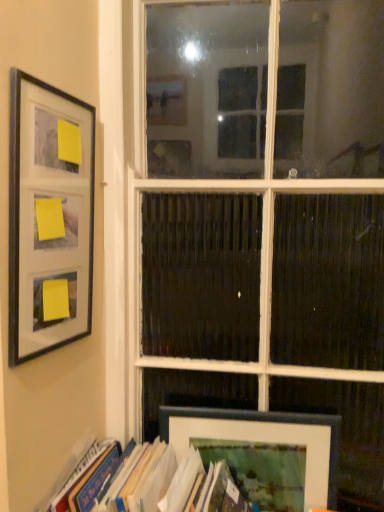
Question: In terms of size, does white glass window at center appear bigger or smaller than hardcover book at lower left?

Choices:
 (A) big
 (B) small

Answer: (A)

Question: From a real-world perspective, relative to hardcover book at lower left, is white glass window at center vertically above or below?

Choices:
 (A) below
 (B) above

Answer: (B)

Question: Which is nearer to the matte black frame at lower right, which is counted as the second picture frame, starting from the top?

Choices:
 (A) hardcover book at lower left
 (B) matte black frame at left, placed as the first picture frame when sorted from front to back
 (C) white glass window at center

Answer: (A)

Question: Which object is positioned farthest from the matte black frame at lower right, marked as the second picture frame in a left-to-right arrangement?

Choices:
 (A) matte black frame at left, placed as the first picture frame when sorted from front to back
 (B) white glass window at center
 (C) hardcover book at lower left

Answer: (A)